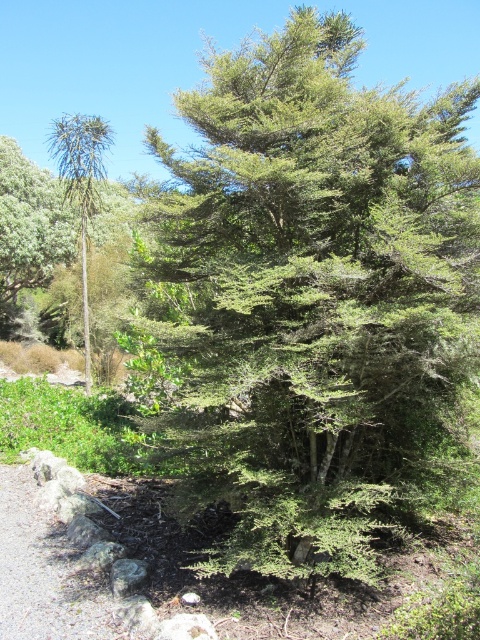
Question: Can you confirm if green leafy tree at center is positioned below green leafy tree at left?

Choices:
 (A) no
 (B) yes

Answer: (B)

Question: Is green leafy tree at center to the left of green leafy tree at left from the viewer's perspective?

Choices:
 (A) yes
 (B) no

Answer: (B)

Question: Can you confirm if green leafy tree at center is positioned above gray gravel trail at lower left?

Choices:
 (A) yes
 (B) no

Answer: (A)

Question: Which point is closer to the camera taking this photo?

Choices:
 (A) (98, 177)
 (B) (12, 584)
 (C) (302, 276)

Answer: (C)

Question: Which point is closer to the camera?

Choices:
 (A) green leafy tree at left
 (B) gray gravel trail at lower left
 (C) green leafy tree at center

Answer: (B)

Question: Among these objects, which one is nearest to the camera?

Choices:
 (A) green leafy tree at left
 (B) gray gravel trail at lower left
 (C) green leafy tree at center

Answer: (B)